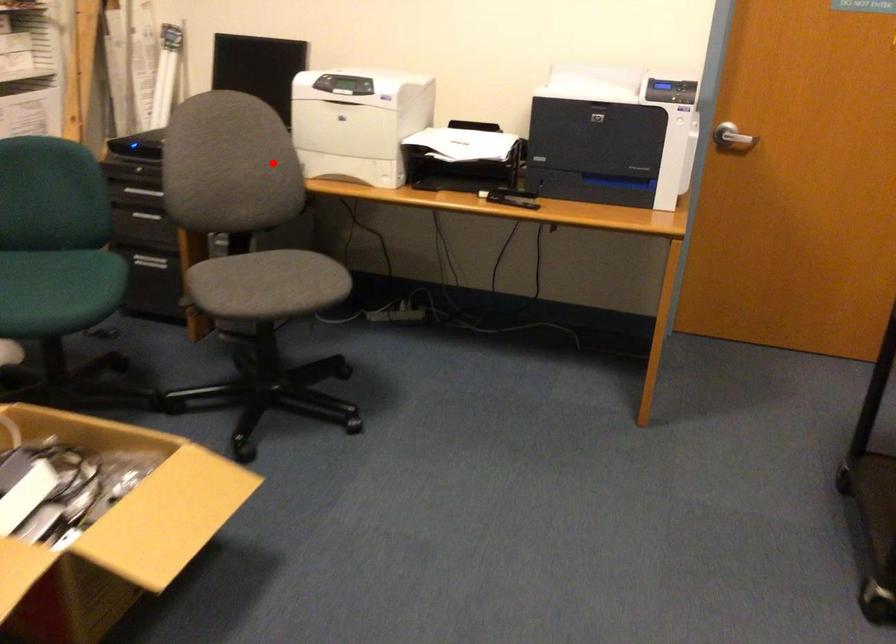
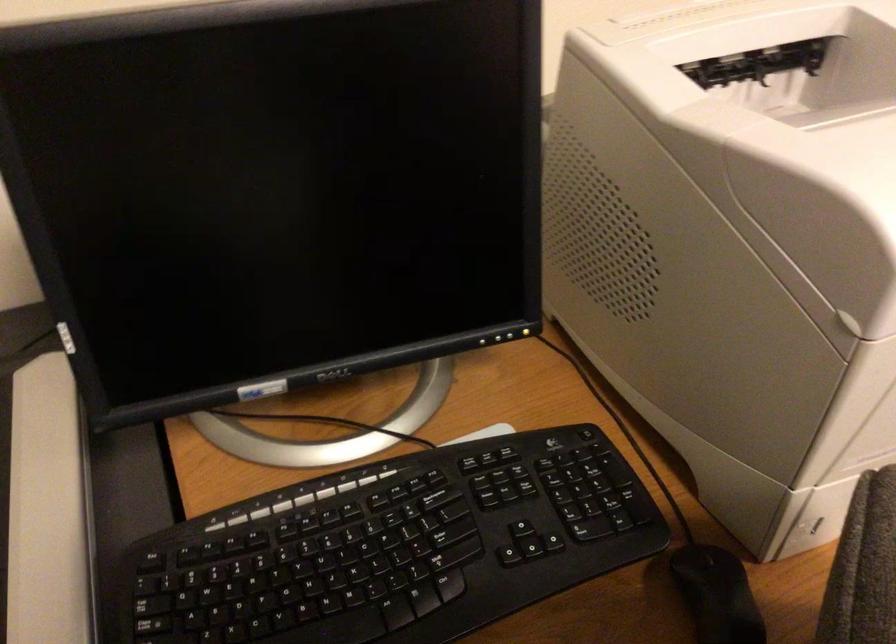
Find the pixel in the second image that matches the highlighted location in the first image.

(717, 594)